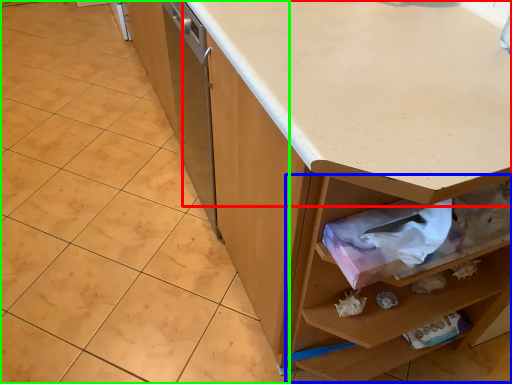
Question: Which object is the farthest from countertop (highlighted by a red box)? Choose among these: drawer (highlighted by a blue box) or granite (highlighted by a green box).

Choices:
 (A) drawer
 (B) granite

Answer: (B)